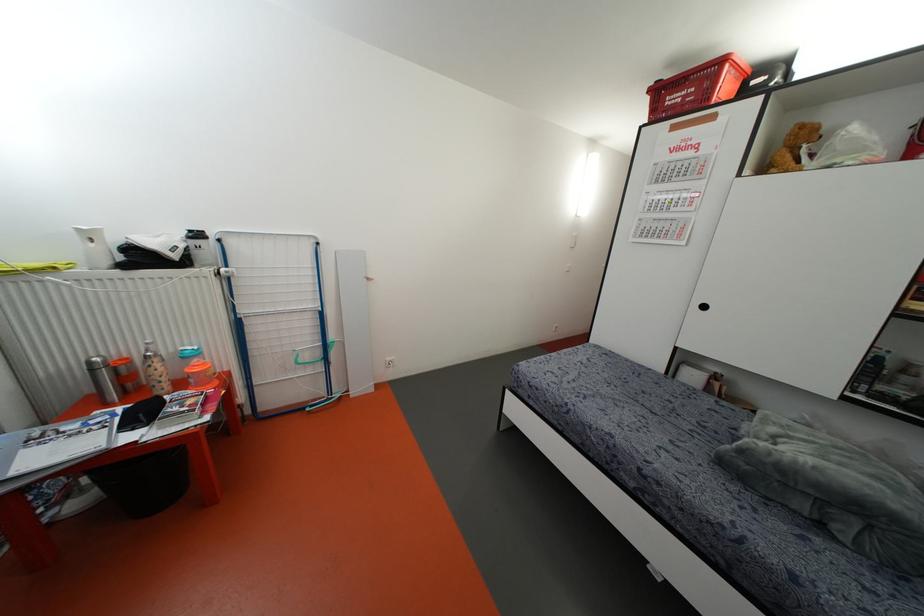
Where is `white plastic pitcher`? The height and width of the screenshot is (616, 924). white plastic pitcher is located at coordinates (93, 246).